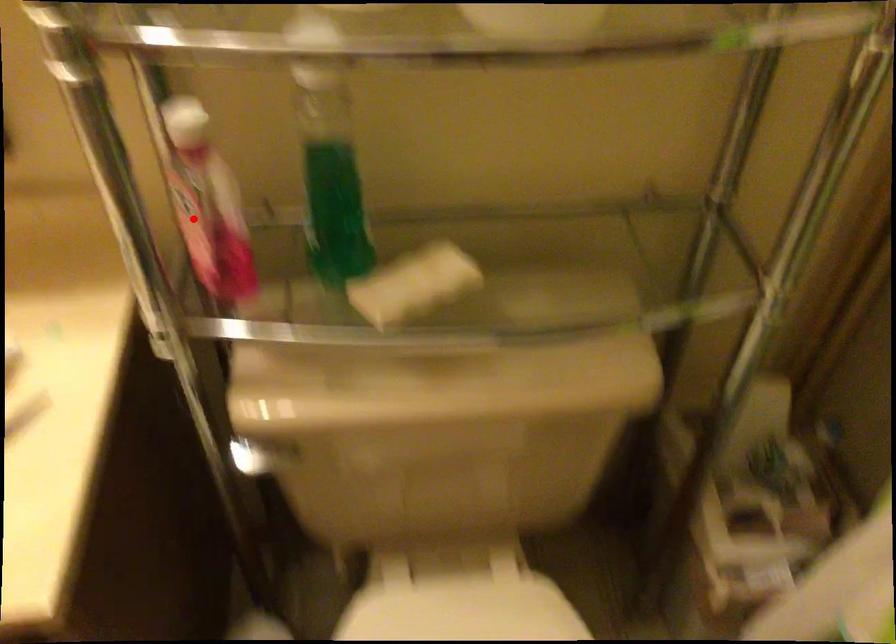
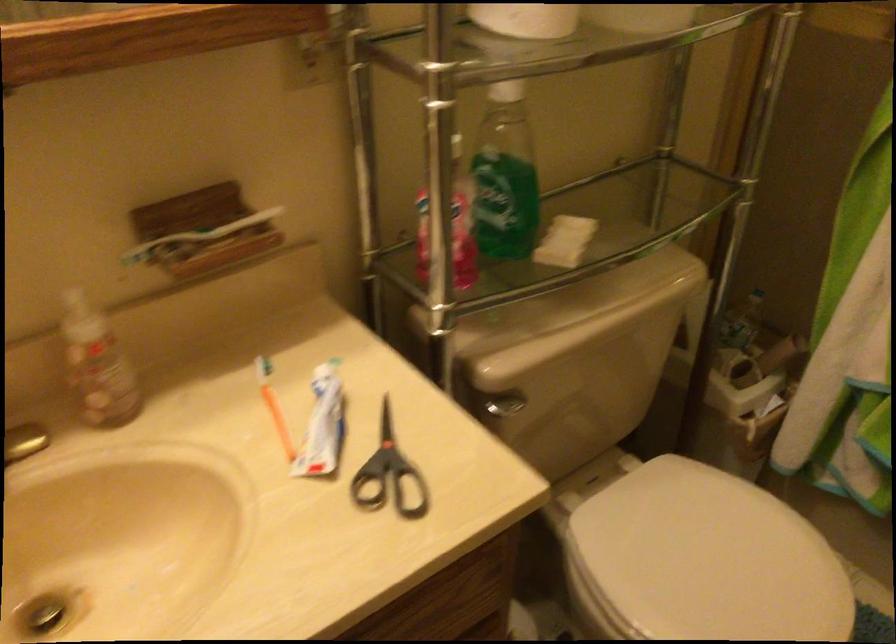
Question: I am providing you with two images of the same scene from different viewpoints. Given a red point in image1, look at the same physical point in image2. Is it:

Choices:
 (A) Closer to the viewpoint
 (B) Farther from the viewpoint

Answer: (B)